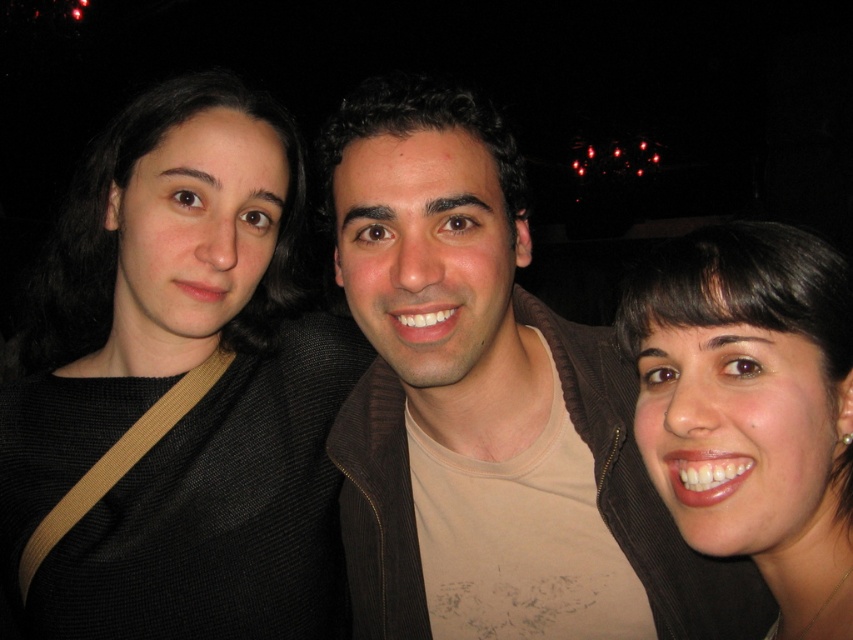
Question: From the image, what is the correct spatial relationship of black textured sweater at left in relation to smooth skin face at center?

Choices:
 (A) left
 (B) right

Answer: (A)

Question: In this image, where is black textured sweater at left located relative to smooth skin face at center?

Choices:
 (A) above
 (B) below

Answer: (A)

Question: Which of the following is the closest to the observer?

Choices:
 (A) smooth skin face at center
 (B) black textured sweater at left

Answer: (A)

Question: Among these points, which one is farthest from the camera?

Choices:
 (A) (680, 438)
 (B) (171, 90)

Answer: (B)

Question: Is black textured sweater at left bigger than smooth skin face at center?

Choices:
 (A) no
 (B) yes

Answer: (B)